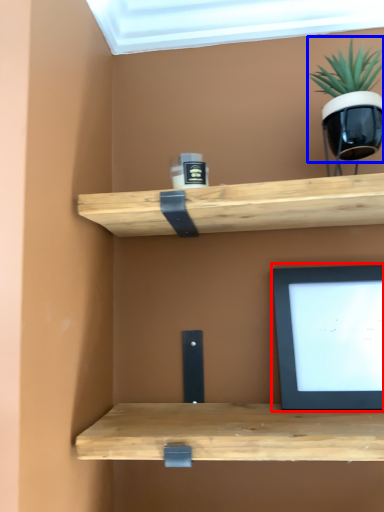
Question: Which object is further to the camera taking this photo, computer monitor (highlighted by a red box) or houseplant (highlighted by a blue box)?

Choices:
 (A) computer monitor
 (B) houseplant

Answer: (A)